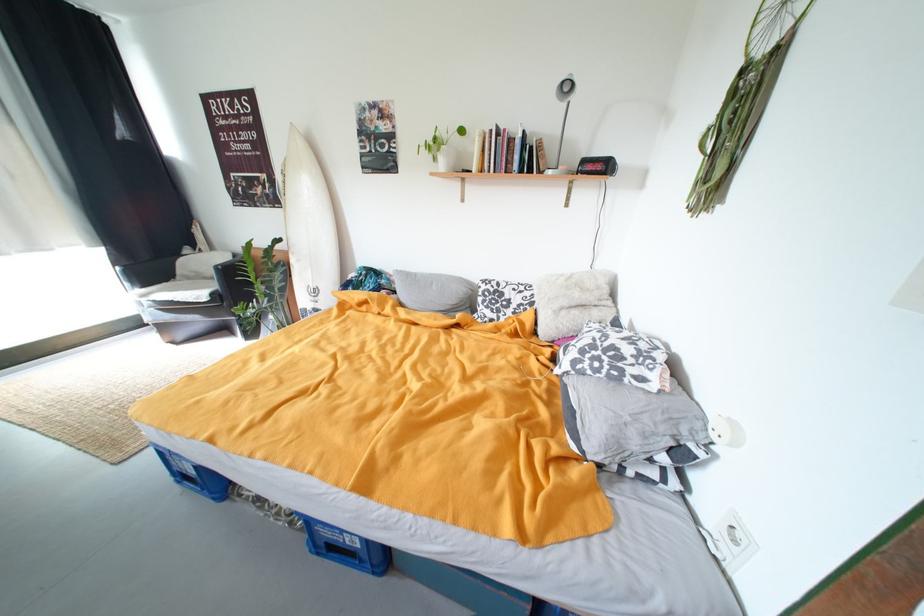
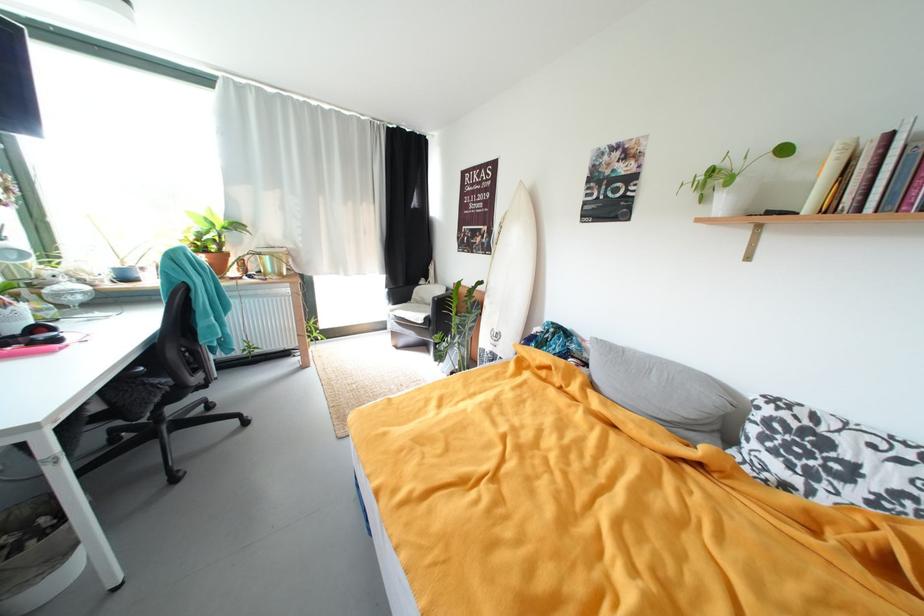
Question: I am providing you with two images of the same scene from different viewpoints. After the viewpoint changes to image2, which objects are now occluded?

Choices:
 (A) patterned pillow
 (B) hardcover book
 (C) black chair armrest
 (D) none of these

Answer: (D)